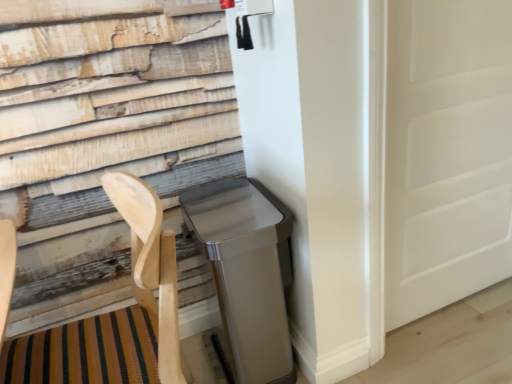
You are a GUI agent. You are given a task and a screenshot of the screen. Output one action in this format:
    pyautogui.click(x=<x>, y=<y>)
    Task: Click on the free spot below white matte door at right (from a real-world perspective)
    The height and width of the screenshot is (384, 512).
    Given the screenshot: What is the action you would take?
    pyautogui.click(x=445, y=309)